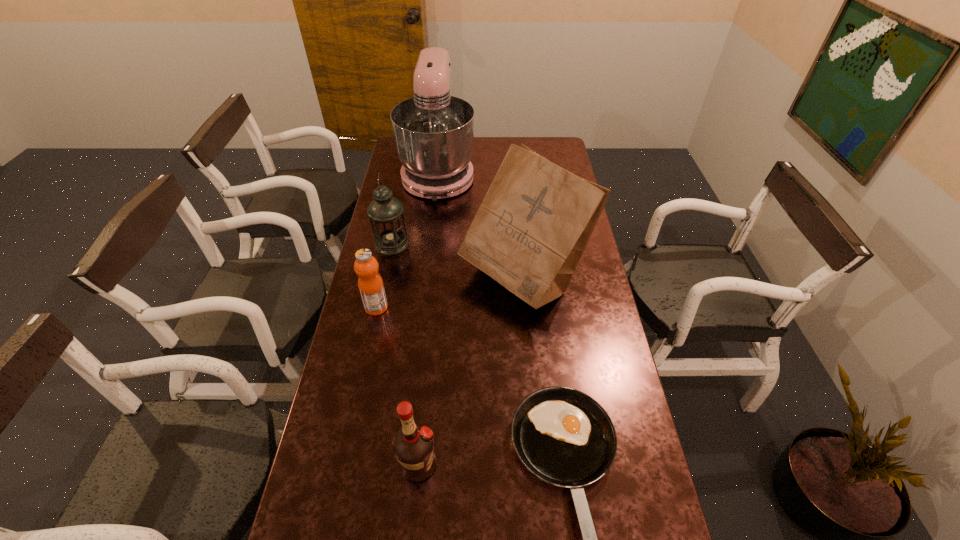
Where is `vacant space that is in between the mixer and the oil lamp`? vacant space that is in between the mixer and the oil lamp is located at coordinates (416, 208).

The width and height of the screenshot is (960, 540). Identify the location of vacant space that's between the fruit juice and the liquor. (397, 386).

Where is `vacant space that is in between the grocery bag and the liquor`? The width and height of the screenshot is (960, 540). vacant space that is in between the grocery bag and the liquor is located at coordinates tap(470, 372).

Identify the location of vacant point located between the grocery bag and the oil lamp. The width and height of the screenshot is (960, 540). (457, 261).

Identify which object is the second nearest to the second shortest object. Please provide its 2D coordinates. Your answer should be formatted as a tuple, i.e. [(x, y)], where the tuple contains the x and y coordinates of a point satisfying the conditions above.

[(533, 225)]

You are a GUI agent. You are given a task and a screenshot of the screen. Output one action in this format:
    pyautogui.click(x=<x>, y=<y>)
    Task: Click on the third closest object relative to the mixer
    This screenshot has height=540, width=960.
    Given the screenshot: What is the action you would take?
    pyautogui.click(x=371, y=287)

The width and height of the screenshot is (960, 540). I want to click on vacant space that satisfies the following two spatial constraints: 1. on the front-facing side of the farthest object; 2. on the left side of the grocery bag, so click(x=426, y=279).